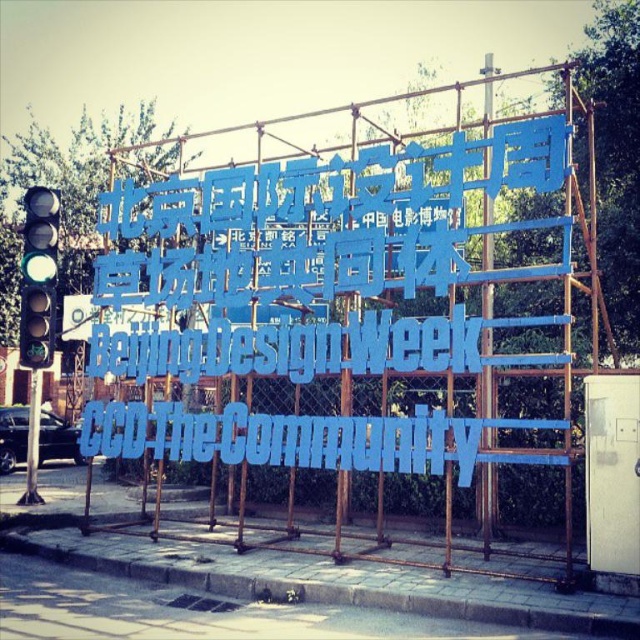
You are standing in front of the Beijing International Design Week structure and want to reach the two points marked on the scaffolding. Which point is closer to you, point 1 at coordinates (362, 348) or point 2 at coordinates (52, 316)?

Point 1 at coordinates (362, 348) is closer to you than point 2 at coordinates (52, 316).

You are standing in front of the Beijing International Design Week structure. There are two points marked on the scaffolding. One is at coordinate point [141,454] and the other is at coordinate point [442,356]. Which point is closer to you?

Point [141,454] is further to the camera than point [442,356], so the point closer to you is point [442,356].

You are an event organizer planning to place a decorative banner between the blue plastic letters at center and the green matte traffic light at left. Given their widths, which object should the banner be placed closer to to ensure it doesn

The blue plastic letters at center are wider than the green matte traffic light at left. Therefore, the banner should be placed closer to the green matte traffic light at left to maintain balance between the two objects.